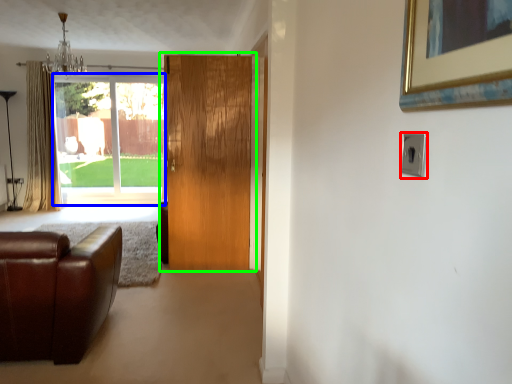
Question: Which is farther away from electric outlet (highlighted by a red box)? window (highlighted by a blue box) or door (highlighted by a green box)?

Choices:
 (A) window
 (B) door

Answer: (A)